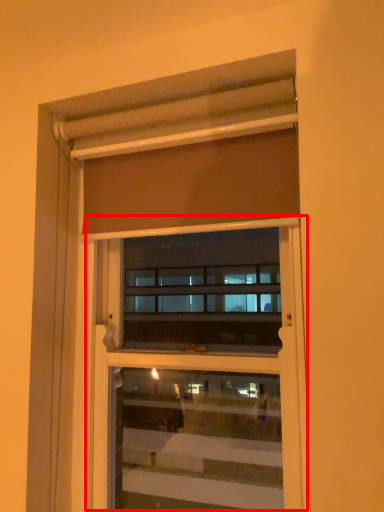
Question: Where is screen door (annotated by the red box) located in relation to curtain in the image?

Choices:
 (A) left
 (B) right

Answer: (B)